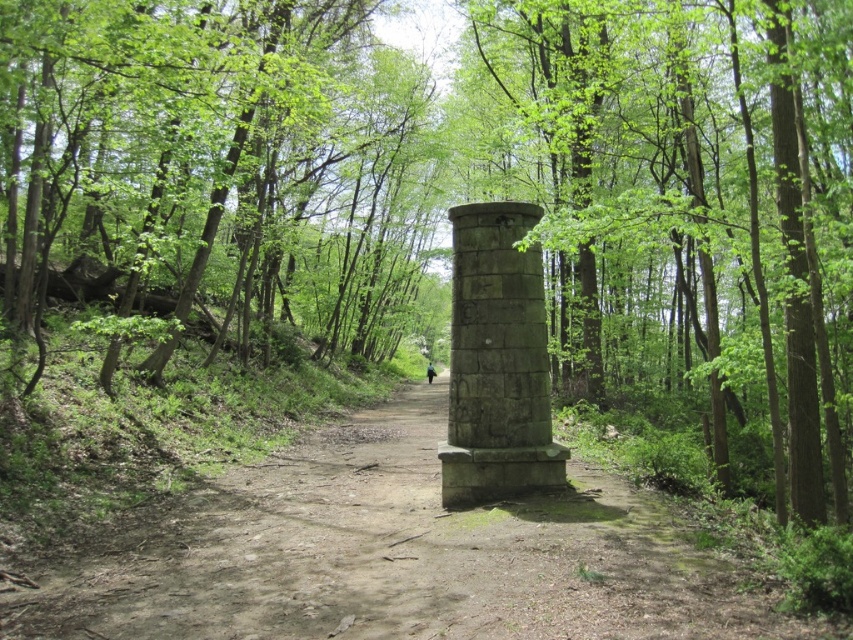
Question: Which of the following is the closest to the observer?

Choices:
 (A) (363, 634)
 (B) (10, 161)

Answer: (A)

Question: Which is farther from the stone column at center?

Choices:
 (A) gray stone column at center
 (B) dull gray stone path at center
 (C) green leafy trees at left

Answer: (A)

Question: Can you confirm if green leafy trees at left is smaller than stone column at center?

Choices:
 (A) no
 (B) yes

Answer: (A)

Question: Is green leafy trees at left closer to the viewer compared to dull gray stone path at center?

Choices:
 (A) yes
 (B) no

Answer: (B)

Question: Does green leafy trees at left have a lesser width compared to gray stone column at center?

Choices:
 (A) yes
 (B) no

Answer: (B)

Question: Among these points, which one is farthest from the camera?

Choices:
 (A) (38, 212)
 (B) (543, 330)
 (C) (610, 3)

Answer: (A)